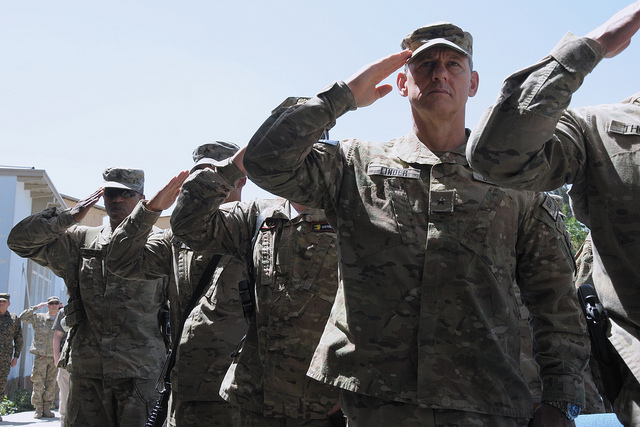
Find the location of a particular element. The height and width of the screenshot is (427, 640). windows is located at coordinates (32, 266), (38, 266), (45, 270), (49, 285), (42, 285), (34, 284).